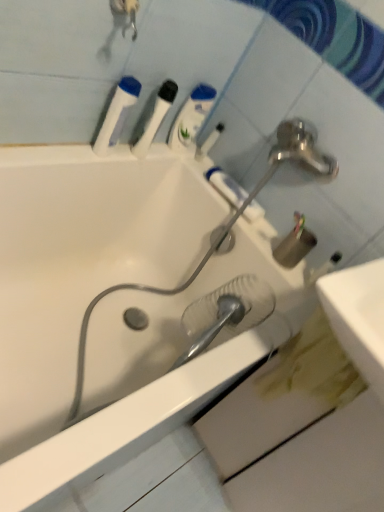
At what (x,y) coordinates should I click in order to perform the action: click on vacant area that lies between white matte toothpaste at upper center and white plastic bottle at upper center, which is counted as the first mouthwash, starting from the right. Please return your answer as a coordinate pair (x, y). This screenshot has width=384, height=512. Looking at the image, I should click on (204, 170).